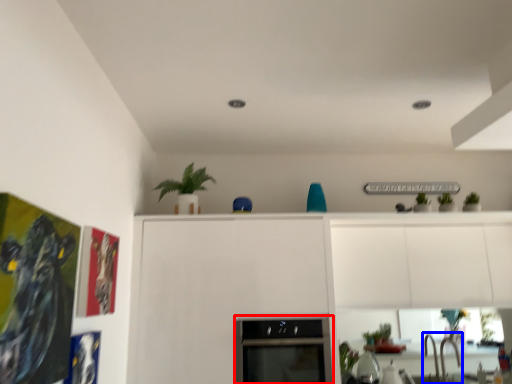
Question: Which point is further to the camera, oven (highlighted by a red box) or sink (highlighted by a blue box)?

Choices:
 (A) oven
 (B) sink

Answer: (B)